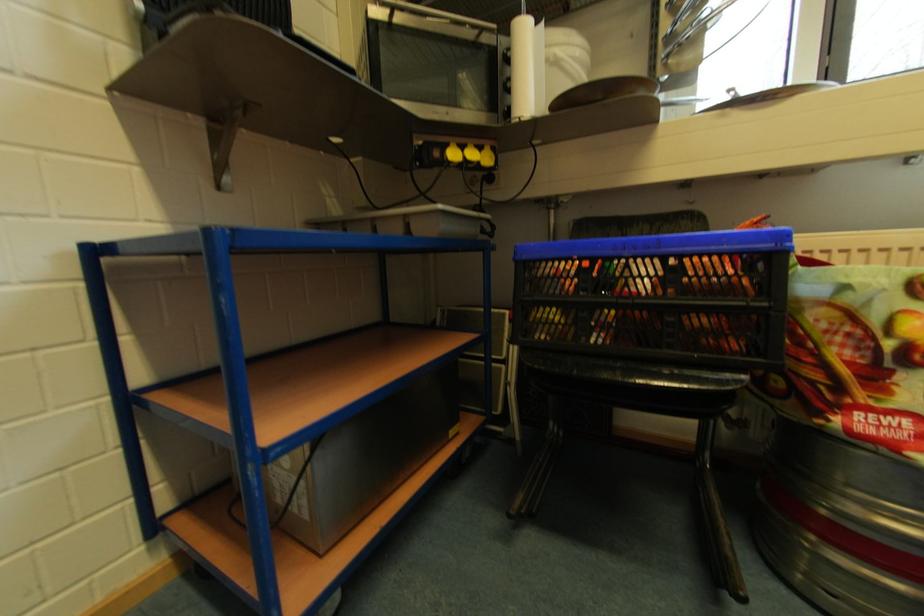
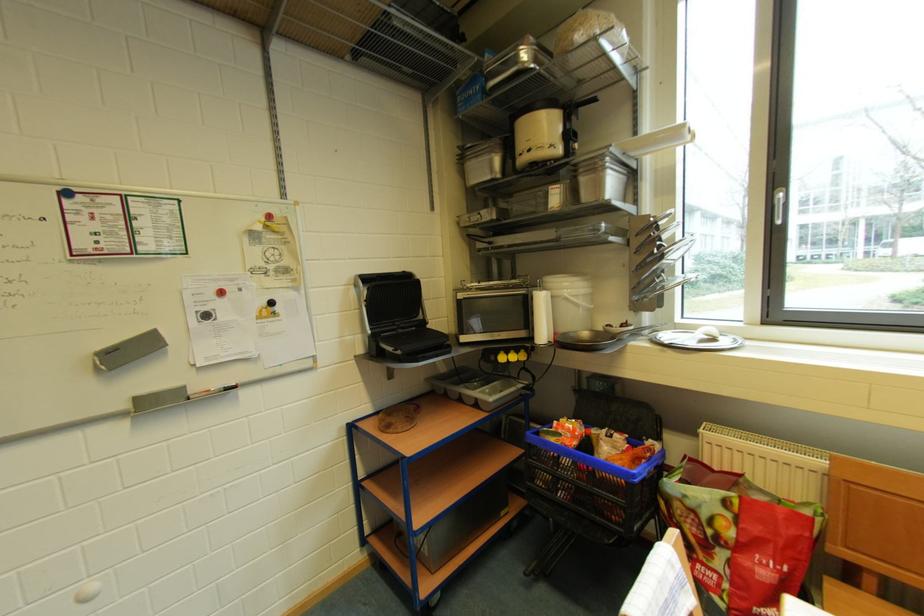
What movement of the cameraman would produce the second image?

The cameraman moved toward right, backward.